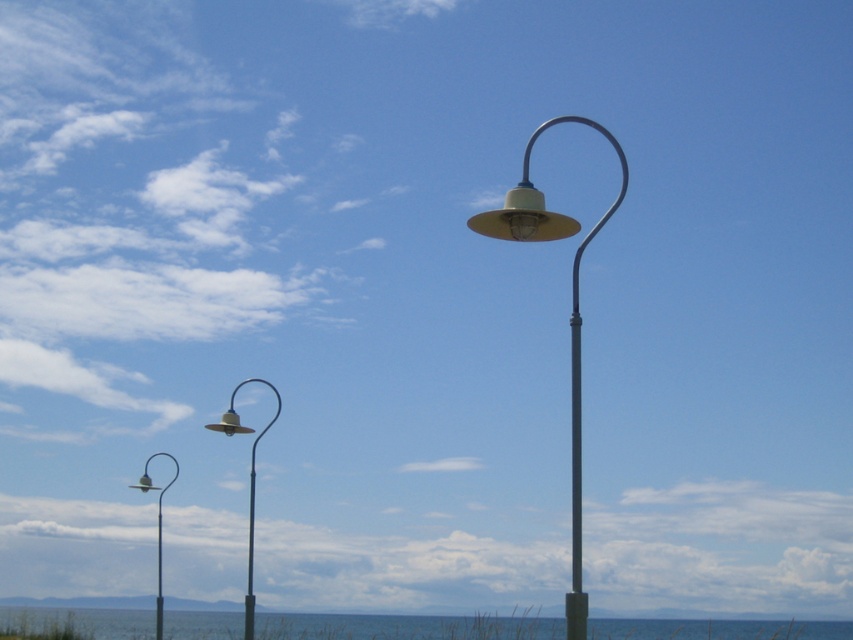
Question: Does matte yellow metal lamp post at left lie in front of matte silver lamp post at left?

Choices:
 (A) no
 (B) yes

Answer: (B)

Question: Based on their relative distances, which object is farther from the metallic silver pole at center?

Choices:
 (A) matte yellow metal lamp post at center
 (B) blue water at lower center
 (C) matte yellow metal lamp post at left
 (D) matte silver lamp post at left

Answer: (B)

Question: Is matte yellow metal lamp post at center above matte silver lamp post at left?

Choices:
 (A) yes
 (B) no

Answer: (A)

Question: Is blue water at lower center below matte yellow metal lamp post at center?

Choices:
 (A) yes
 (B) no

Answer: (A)

Question: Among these points, which one is nearest to the camera?

Choices:
 (A) (248, 634)
 (B) (576, 294)
 (C) (253, 522)

Answer: (B)

Question: Which point appears farthest from the camera in this image?

Choices:
 (A) (567, 620)
 (B) (251, 531)
 (C) (247, 573)
 (D) (140, 486)

Answer: (D)